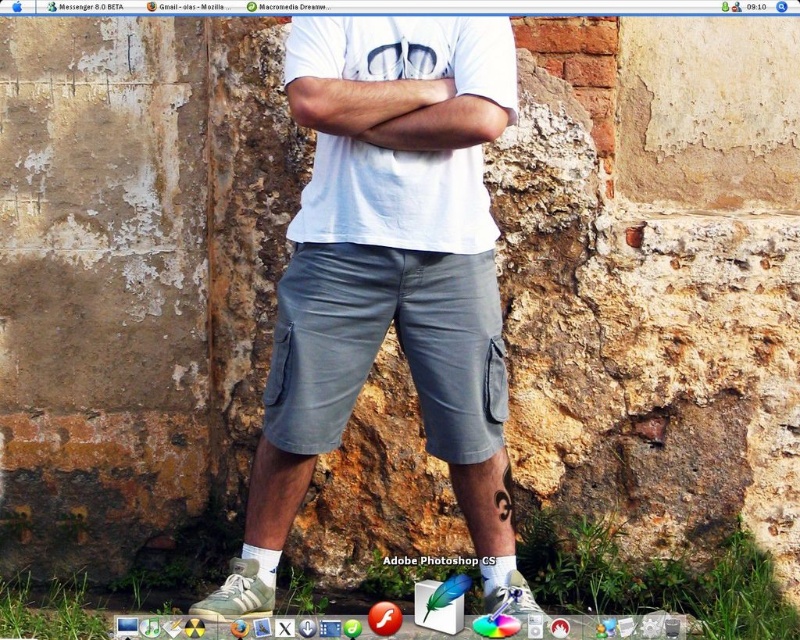
Who is higher up, gray cotton shorts at center or white matte t-shirt at center?

Positioned higher is white matte t-shirt at center.

Is gray cotton shorts at center above white matte t-shirt at center?

Incorrect, gray cotton shorts at center is not positioned above white matte t-shirt at center.

Based on the photo, who is more forward, (474, 500) or (320, 128)?

Point (320, 128) is in front.

You are a GUI agent. You are given a task and a screenshot of the screen. Output one action in this format:
    pyautogui.click(x=<x>, y=<y>)
    Task: Click on the gray cotton shorts at center
    The width and height of the screenshot is (800, 640).
    Given the screenshot: What is the action you would take?
    pyautogui.click(x=388, y=275)